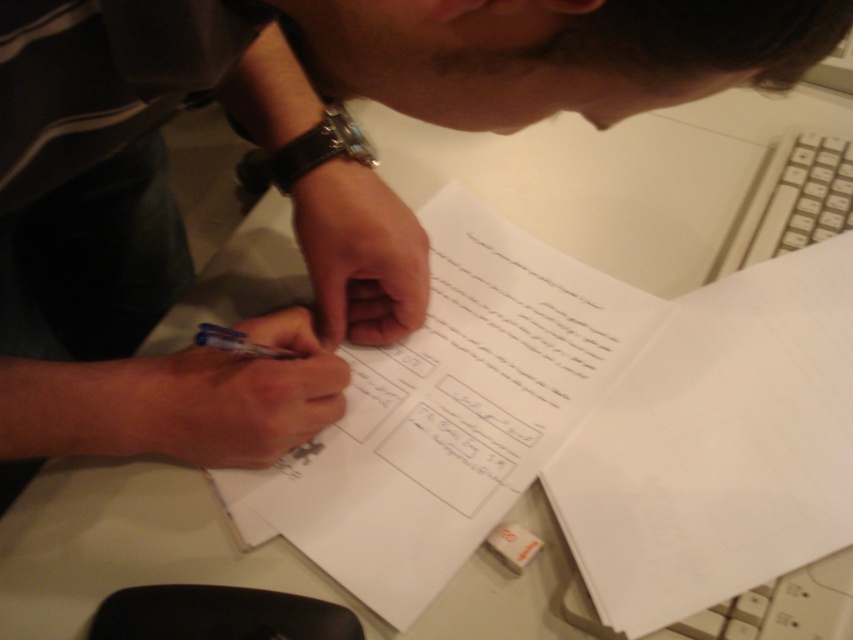
Question: Can you confirm if white plastic keyboard at upper right is bigger than blue plastic pen at center?

Choices:
 (A) yes
 (B) no

Answer: (A)

Question: Which point is closer to the camera?

Choices:
 (A) blue plastic pen at center
 (B) matte black pen at center

Answer: (B)

Question: Can you confirm if white plastic keyboard at upper right is thinner than blue plastic pen at center?

Choices:
 (A) yes
 (B) no

Answer: (B)

Question: Is matte black pen at center below blue plastic pen at center?

Choices:
 (A) no
 (B) yes

Answer: (A)

Question: Which object is the farthest from the white plastic keyboard at upper right?

Choices:
 (A) blue plastic pen at center
 (B) matte black pen at center
 (C) white paper at center

Answer: (A)

Question: Based on their relative distances, which object is farther from the blue plastic pen at center?

Choices:
 (A) white paper at center
 (B) matte black pen at center
 (C) white plastic keyboard at upper right

Answer: (C)